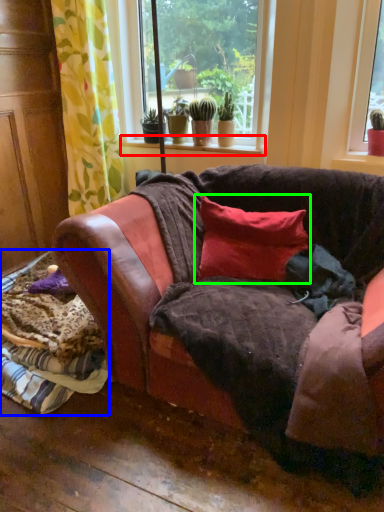
Question: Based on their relative distances, which object is farther from window sill (highlighted by a red box)? Choose from material (highlighted by a blue box) and pillow (highlighted by a green box).

Choices:
 (A) material
 (B) pillow

Answer: (A)